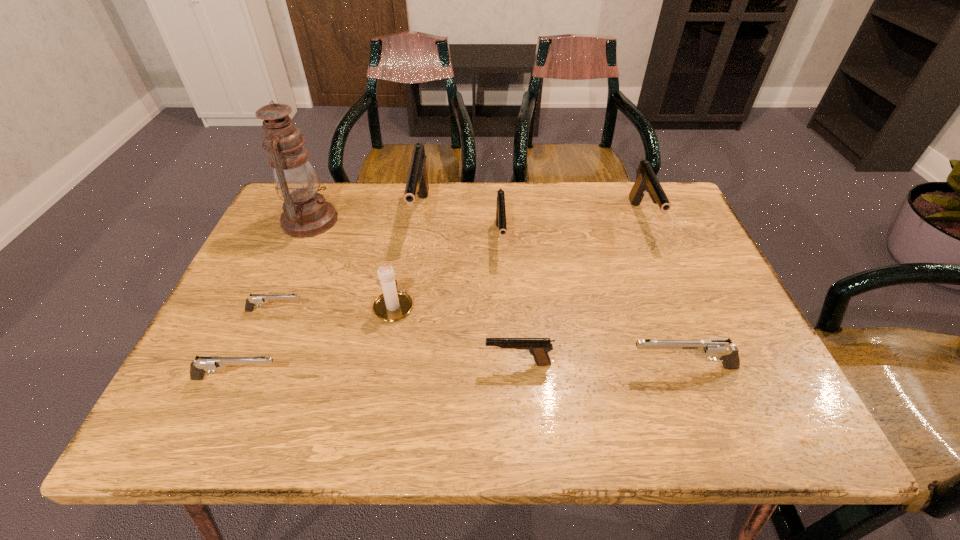
Where is `blank region between the nearest black pistol and the rightmost silver pistol`? This screenshot has width=960, height=540. blank region between the nearest black pistol and the rightmost silver pistol is located at coordinates (600, 366).

Locate an element on the screen. This screenshot has width=960, height=540. vacant point located between the biggest silver pistol and the second biggest black pistol is located at coordinates (662, 293).

Image resolution: width=960 pixels, height=540 pixels. I want to click on vacant region between the smallest silver pistol and the biggest black pistol, so click(348, 262).

I want to click on free space between the tallest object and the fifth shortest object, so click(x=405, y=230).

Identify the location of free point between the candle holder and the second biggest silver pistol. The height and width of the screenshot is (540, 960). (316, 342).

In order to click on unoccupied area between the shortest object and the white candle holder in this screenshot , I will do `click(335, 308)`.

Locate an element on the screen. object that is the fifth closest to the nearest silver pistol is located at coordinates (417, 183).

Where is `object that ranks as the eighth closest to the rightmost silver pistol`? The width and height of the screenshot is (960, 540). object that ranks as the eighth closest to the rightmost silver pistol is located at coordinates (306, 213).

Locate an element on the screen. This screenshot has width=960, height=540. pistol that stands as the fifth closest to the tallest object is located at coordinates (538, 347).

I want to click on pistol identified as the fifth closest to the rightmost silver pistol, so pos(203,364).